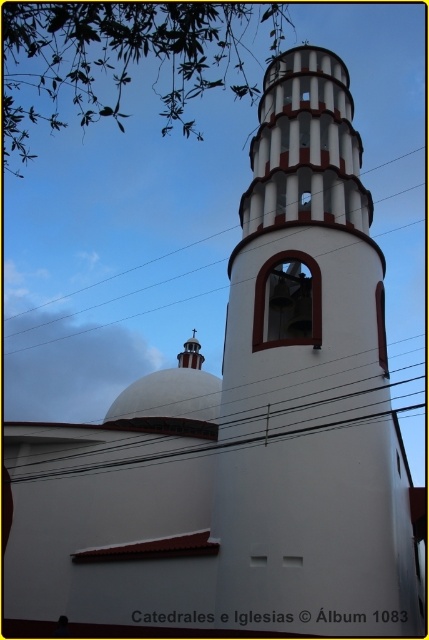
Between white smooth dome at center and black wire at center, which one has more height?

Standing taller between the two is black wire at center.

Does white smooth dome at center lie behind black wire at center?

No, it is not.

Is point (192, 384) more distant than point (395, 397)?

No.

Identify the location of white smooth dome at center. Image resolution: width=429 pixels, height=640 pixels. (172, 390).

How distant is white smooth bell tower at center from black wire at center?

The distance of white smooth bell tower at center from black wire at center is 98.87 meters.

Between white smooth bell tower at center and black wire at center, which one has less height?

With less height is black wire at center.

This screenshot has height=640, width=429. Find the location of `white smooth bell tower at center`. white smooth bell tower at center is located at coordinates (310, 381).

Locate an element on the screen. The image size is (429, 640). white smooth bell tower at center is located at coordinates (310, 381).

Can you confirm if white smooth bell tower at center is positioned below black wire at upper center?

Yes.

Between point (353, 285) and point (26, 312), which one is positioned in front?

Positioned in front is point (353, 285).

Which is in front, point (338, 182) or point (172, 278)?

Point (338, 182) is more forward.

Where is `white smooth bell tower at center`? The width and height of the screenshot is (429, 640). white smooth bell tower at center is located at coordinates (310, 381).